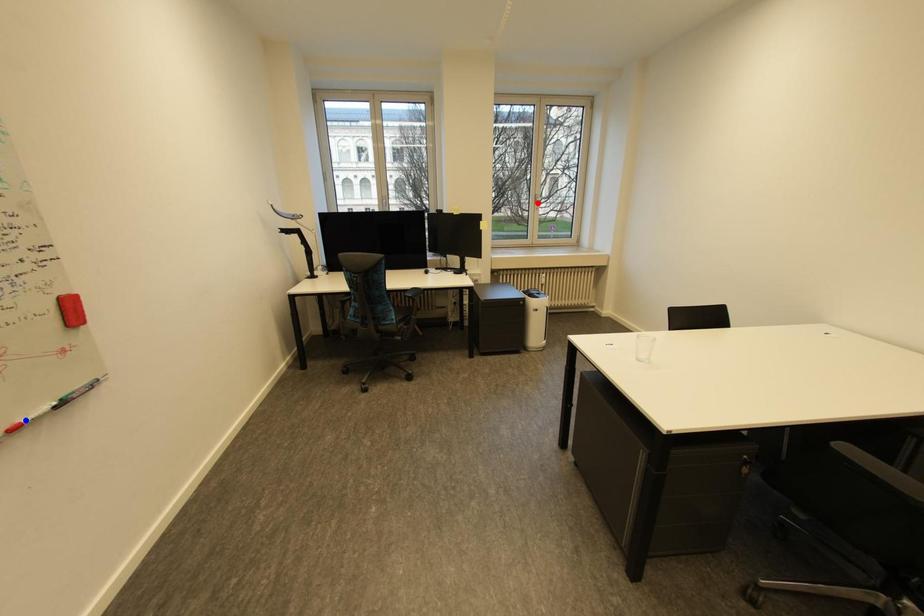
Question: Two points are marked on the image. Which point is closer to the camera?

Choices:
 (A) Blue point is closer.
 (B) Red point is closer.

Answer: (A)